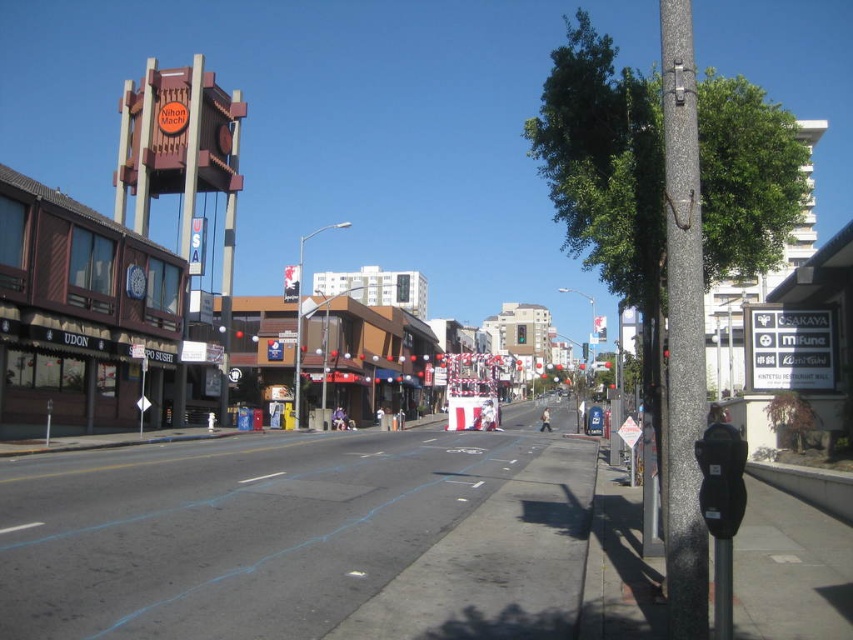
Is point (675, 550) less distant than point (730, 461)?

That is False.

Who is positioned more to the left, granite pole at right or black plastic parking meter at right?

black plastic parking meter at right is more to the left.

The height and width of the screenshot is (640, 853). What do you see at coordinates (682, 332) in the screenshot?
I see `granite pole at right` at bounding box center [682, 332].

This screenshot has height=640, width=853. Find the location of `granite pole at right`. granite pole at right is located at coordinates (682, 332).